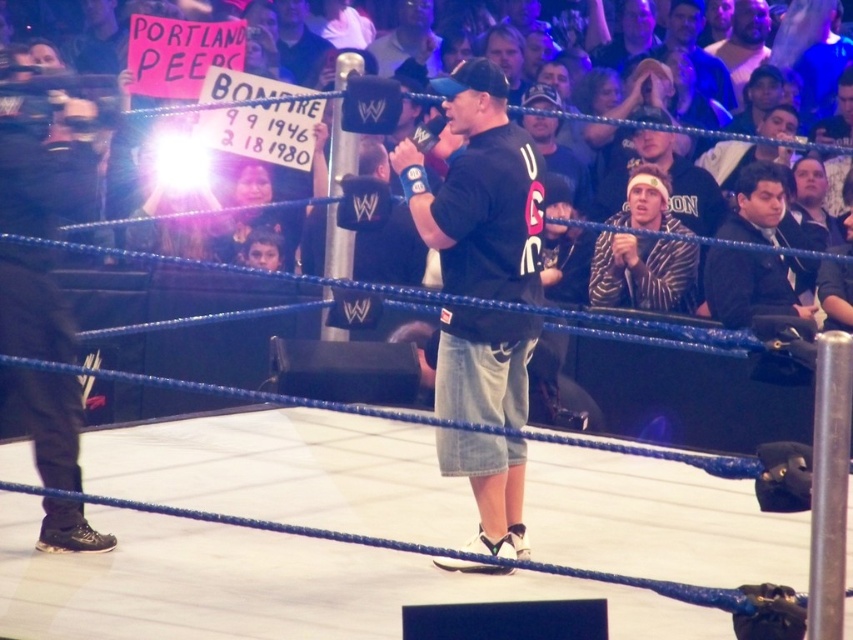
You are a photographer positioned at the back of the arena. You need to take a photo of both the black denim shorts at center and the black suit at right. Which object should you focus on first to ensure both are in the frame?

You should focus on the black suit at right first because the black denim shorts at center is thinner than the black suit at right, so it will require less space in the frame initially, allowing you to adjust the camera to include both.